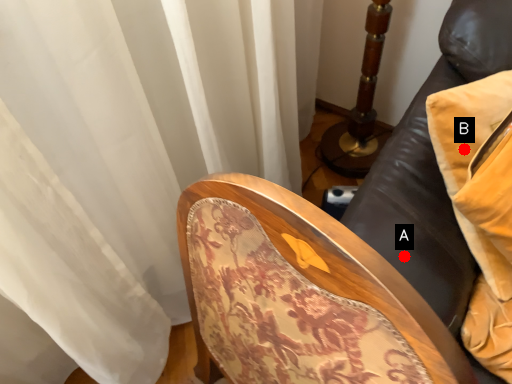
Question: Two points are circled on the image, labeled by A and B beside each circle. Which point is closer to the camera?

Choices:
 (A) A is closer
 (B) B is closer

Answer: (A)